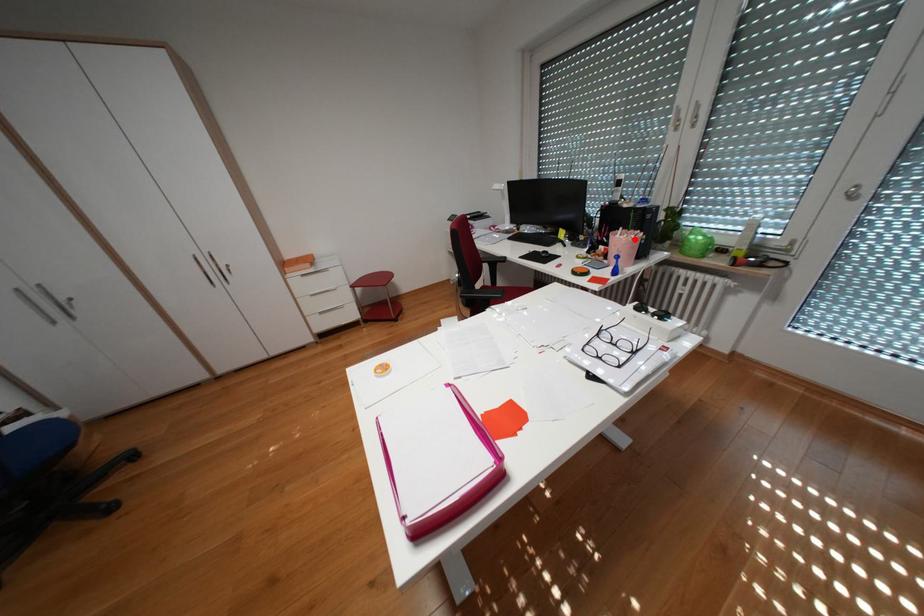
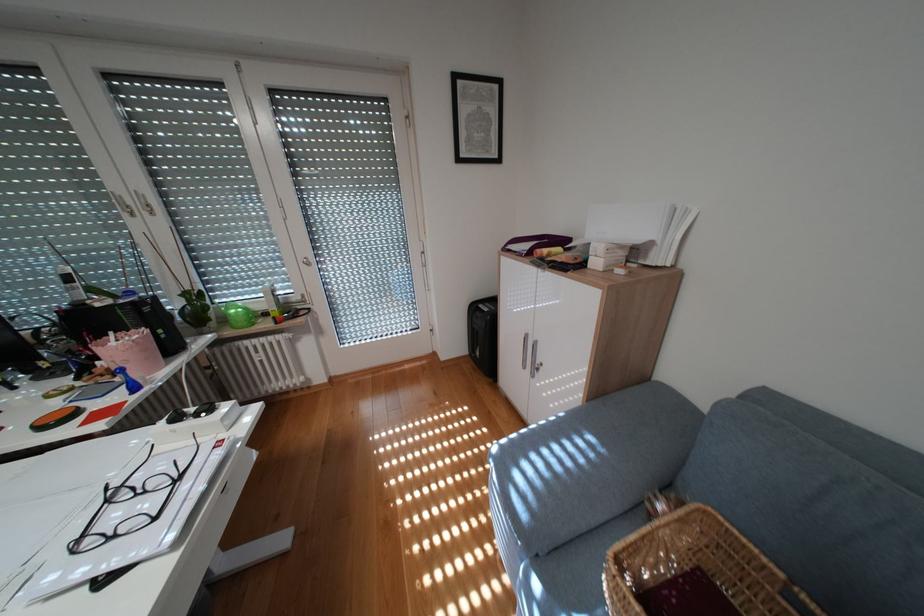
Question: I am providing you with two images of the same scene from different viewpoints. Given a red point in image1, look at the same physical point in image2. Is it:

Choices:
 (A) Closer to the viewpoint
 (B) Farther from the viewpoint

Answer: (B)